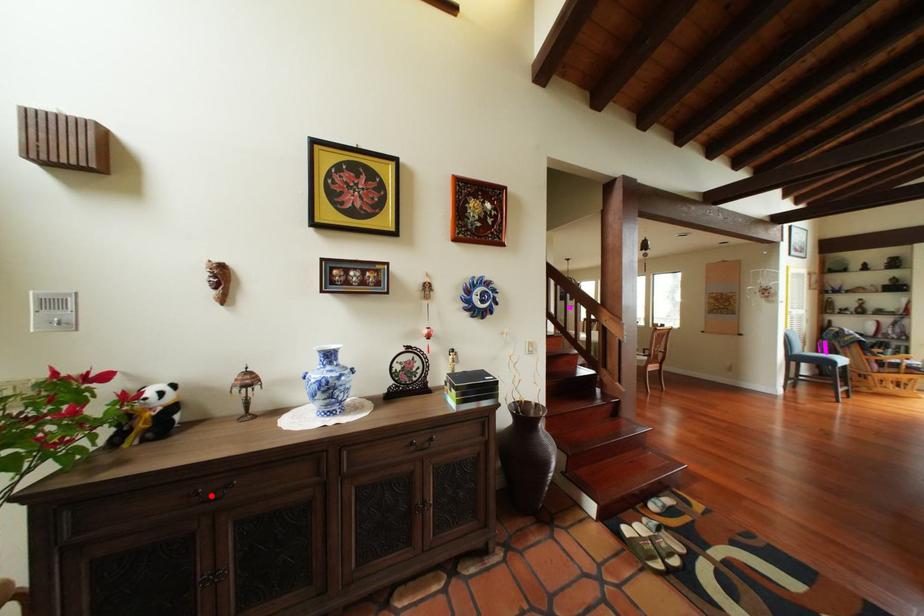
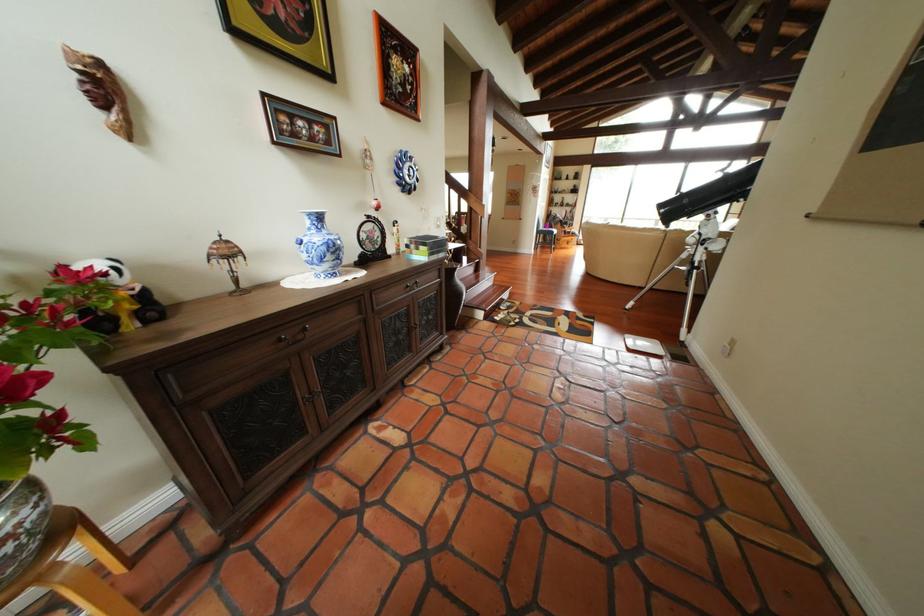
Where in the second image is the point corresponding to the highlighted location from the first image?

(298, 339)